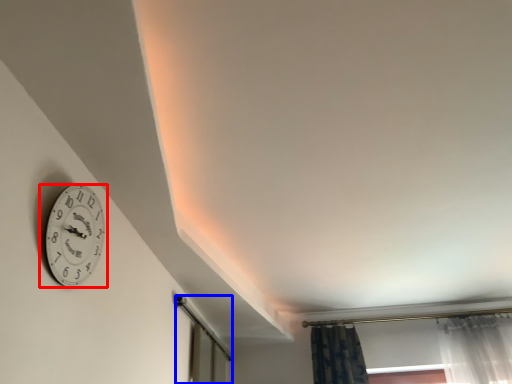
Question: Which of the following is the closest to the observer, wall clock (highlighted by a red box) or glass door (highlighted by a blue box)?

Choices:
 (A) wall clock
 (B) glass door

Answer: (A)